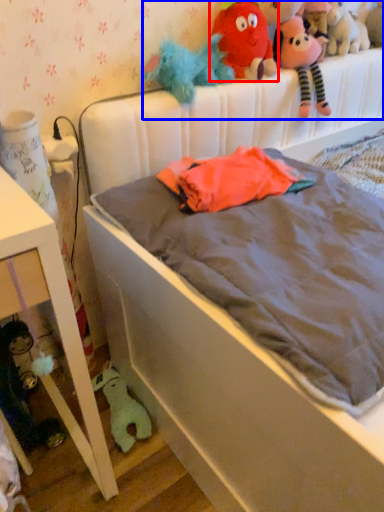
Question: Which object appears closest to the camera in this image, toy (highlighted by a red box) or stuff (highlighted by a blue box)?

Choices:
 (A) toy
 (B) stuff

Answer: (A)